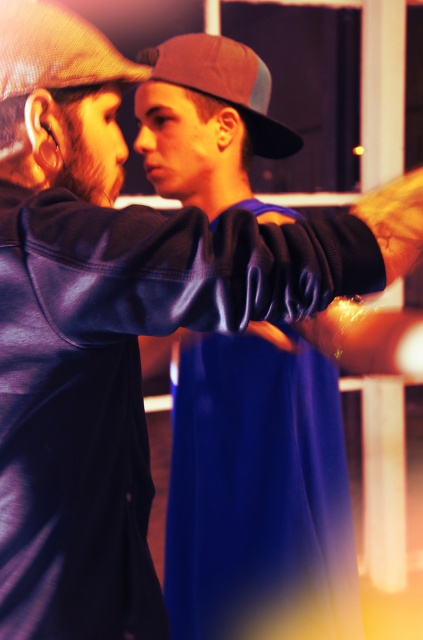
Based on the photo, is matte brown baseball cap at upper left above brown mesh baseball cap at center?

No, matte brown baseball cap at upper left is not above brown mesh baseball cap at center.

Image resolution: width=423 pixels, height=640 pixels. I want to click on matte brown baseball cap at upper left, so click(55, 51).